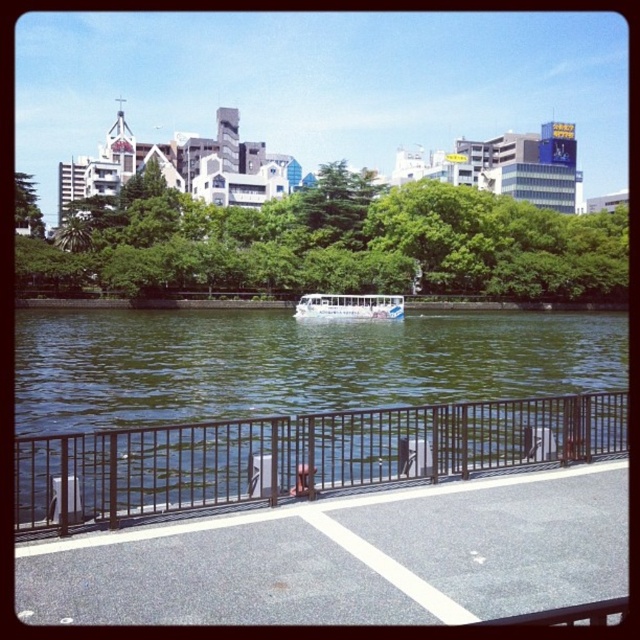
You are a photographer planning to capture a wide shot of the scene. The camera you are using has a maximum horizontal field of view of 60 degrees. Given that the green leafy tree at center and the white glossy boat at center are both in the center of your frame, which object would require a wider field of view to fully capture?

The green leafy tree at center has a larger width than the white glossy boat at center, so it would require a wider field of view to fully capture.